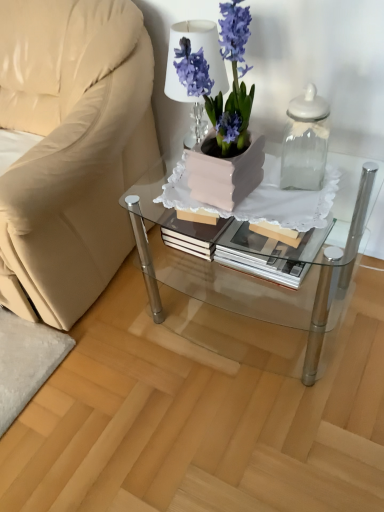
The image size is (384, 512). In order to click on clear glass jar at upper right in this screenshot , I will do `click(305, 142)`.

The width and height of the screenshot is (384, 512). Describe the element at coordinates (224, 115) in the screenshot. I see `matte ceramic vase at center` at that location.

Locate an element on the screen. white glossy table lamp at upper center is located at coordinates (194, 70).

You are a GUI agent. You are given a task and a screenshot of the screen. Output one action in this format:
    pyautogui.click(x=<x>, y=<y>)
    Task: Click on the clear glass jar at upper right
    The height and width of the screenshot is (512, 384).
    Given the screenshot: What is the action you would take?
    pyautogui.click(x=305, y=142)

Considering the relative sizes of white glossy table lamp at upper center and clear glass jar at upper right in the image provided, is white glossy table lamp at upper center bigger than clear glass jar at upper right?

Yes, white glossy table lamp at upper center is bigger than clear glass jar at upper right.

Measure the distance from white glossy table lamp at upper center to clear glass jar at upper right.

11.23 inches.

Between white glossy table lamp at upper center and clear glass jar at upper right, which one appears on the left side from the viewer's perspective?

white glossy table lamp at upper center is more to the left.

From the image's perspective, is white glossy table lamp at upper center above or below beige fabric chair at left?

From the image's perspective, white glossy table lamp at upper center appears above beige fabric chair at left.

Can you confirm if white glossy table lamp at upper center is taller than beige fabric chair at left?

Incorrect, the height of white glossy table lamp at upper center is not larger of that of beige fabric chair at left.

Where is `table lamp that appears above the beige fabric chair at left (from the image's perspective)`? table lamp that appears above the beige fabric chair at left (from the image's perspective) is located at coordinates coord(194,70).

Can you confirm if white glossy table lamp at upper center is positioned to the right of matte ceramic vase at center?

No.

Is white glossy table lamp at upper center wider or thinner than matte ceramic vase at center?

white glossy table lamp at upper center is thinner than matte ceramic vase at center.

Considering the sizes of white glossy table lamp at upper center and matte ceramic vase at center in the image, is white glossy table lamp at upper center taller or shorter than matte ceramic vase at center?

Clearly, white glossy table lamp at upper center is shorter compared to matte ceramic vase at center.

From their relative heights in the image, would you say matte ceramic vase at center is taller or shorter than clear glass jar at upper right?

Considering their sizes, matte ceramic vase at center has more height than clear glass jar at upper right.

Does matte ceramic vase at center appear on the right side of clear glass jar at upper right?

No.

Can you see matte ceramic vase at center touching clear glass jar at upper right?

No, matte ceramic vase at center is not touching clear glass jar at upper right.

Is matte ceramic vase at center situated inside clear glass jar at upper right or outside?

matte ceramic vase at center is outside clear glass jar at upper right.

Considering the relative positions of beige fabric chair at left and clear glass coffee table at center in the image provided, is beige fabric chair at left to the right of clear glass coffee table at center from the viewer's perspective?

Incorrect, beige fabric chair at left is not on the right side of clear glass coffee table at center.

From the image's perspective, is beige fabric chair at left positioned above or below clear glass coffee table at center?

Based on their image positions, beige fabric chair at left is located above clear glass coffee table at center.

From the picture: From a real-world perspective, who is located higher, beige fabric chair at left or clear glass coffee table at center?

beige fabric chair at left is physically above.

Would you say beige fabric chair at left is outside clear glass coffee table at center?

Indeed, beige fabric chair at left is completely outside clear glass coffee table at center.

Would you say matte ceramic vase at center is part of clear glass jar at upper right's contents?

No, matte ceramic vase at center is not inside clear glass jar at upper right.

How different are the orientations of clear glass jar at upper right and matte ceramic vase at center in degrees?

The facing directions of clear glass jar at upper right and matte ceramic vase at center are 19.5 degrees apart.

Locate an element on the screen. houseplant located above the clear glass jar at upper right (from a real-world perspective) is located at coordinates (224, 115).

From a real-world perspective, is clear glass jar at upper right over matte ceramic vase at center?

No, from a real-world perspective, clear glass jar at upper right is not on top of matte ceramic vase at center.

Can you confirm if matte ceramic vase at center is shorter than clear glass coffee table at center?

Indeed, matte ceramic vase at center has a lesser height compared to clear glass coffee table at center.

Which is closer, (x=229, y=154) or (x=304, y=328)?

The point (x=229, y=154) is more forward.

From the image's perspective, which object appears higher, matte ceramic vase at center or clear glass coffee table at center?

matte ceramic vase at center is shown above in the image.

Which is in front, matte ceramic vase at center or clear glass coffee table at center?

matte ceramic vase at center is more forward.

You are a GUI agent. You are given a task and a screenshot of the screen. Output one action in this format:
    pyautogui.click(x=<x>, y=<y>)
    Task: Click on the table lamp above the clear glass jar at upper right (from the image's perspective)
    
    Given the screenshot: What is the action you would take?
    pyautogui.click(x=194, y=70)

Locate an element on the screen. This screenshot has height=512, width=384. chair below the white glossy table lamp at upper center (from the image's perspective) is located at coordinates (72, 145).

From the image, which object appears to be farther from clear glass jar at upper right, clear glass coffee table at center or beige fabric chair at left?

beige fabric chair at left.

Which object lies further to the anchor point clear glass jar at upper right, clear glass coffee table at center or white glossy table lamp at upper center?

clear glass coffee table at center is further to clear glass jar at upper right.

Considering their positions, is matte ceramic vase at center positioned closer to clear glass coffee table at center than beige fabric chair at left?

Based on the image, matte ceramic vase at center appears to be nearer to clear glass coffee table at center.

Considering their positions, is beige fabric chair at left positioned closer to white glossy table lamp at upper center than clear glass jar at upper right?

clear glass jar at upper right is closer to white glossy table lamp at upper center.

Based on their spatial positions, is beige fabric chair at left or clear glass coffee table at center further from clear glass jar at upper right?

beige fabric chair at left is positioned further to the anchor clear glass jar at upper right.

Which object lies nearer to the anchor point clear glass jar at upper right, matte ceramic vase at center or beige fabric chair at left?

matte ceramic vase at center is closer to clear glass jar at upper right.

From the image, which object appears to be nearer to clear glass coffee table at center, beige fabric chair at left or white glossy table lamp at upper center?

Among the two, beige fabric chair at left is located nearer to clear glass coffee table at center.

Looking at the image, which one is located further to beige fabric chair at left, matte ceramic vase at center or clear glass jar at upper right?

The object further to beige fabric chair at left is clear glass jar at upper right.

This screenshot has width=384, height=512. I want to click on coffee table between beige fabric chair at left and clear glass jar at upper right from left to right, so click(x=252, y=285).

Find the location of a particular element. This screenshot has height=512, width=384. houseplant that lies between white glossy table lamp at upper center and clear glass coffee table at center from top to bottom is located at coordinates (224, 115).

I want to click on vase between matte ceramic vase at center and clear glass coffee table at center vertically, so click(305, 142).

This screenshot has width=384, height=512. I want to click on houseplant situated between beige fabric chair at left and clear glass coffee table at center from left to right, so click(224, 115).